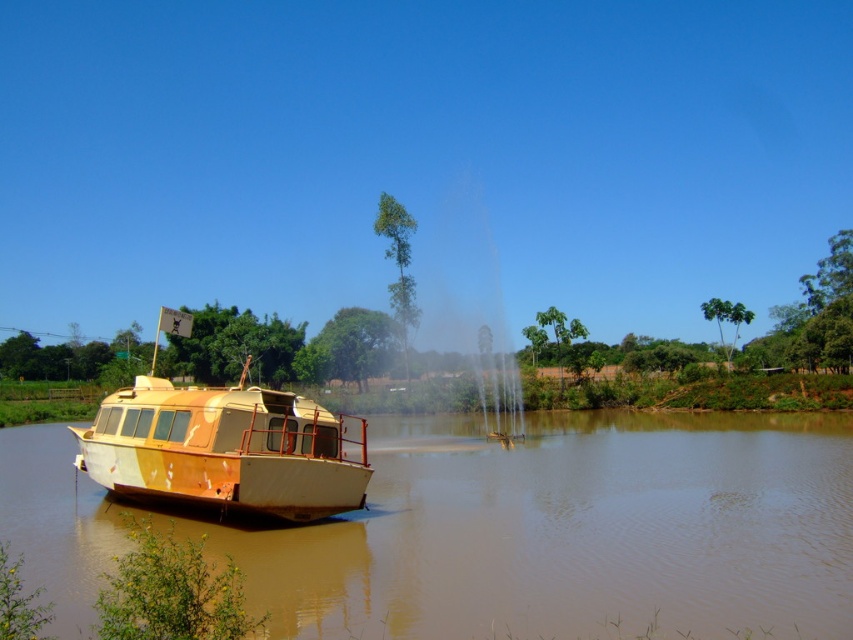
You are standing on the riverside and want to board the brown matte boat at left and the rusty metal boat at left. Which boat is closer to you?

Both boats are at the same distance from you since the brown matte boat at left is 29.48 feet away from rusty metal boat at left, but their positions are not specified relative to your location.

You are a photographer planning to capture both the brown matte boat at left and the rusty metal boat at left in a single frame. Given their sizes, which boat will occupy more space in your photo?

The brown matte boat at left will occupy more space in the photo because its width is larger than that of the rusty metal boat at left.

You are navigating a drone that needs to fly from the fountain to the brown matte boat at left. According to the coordinates provided, in which direction should the drone move relative to the fountain to reach the boat?

The brown matte boat at left is located at coordinates point (x=572, y=531). Since the fountain is in the middle ground and the boat is at the left, the drone should move towards the left direction from the fountain to reach the boat.